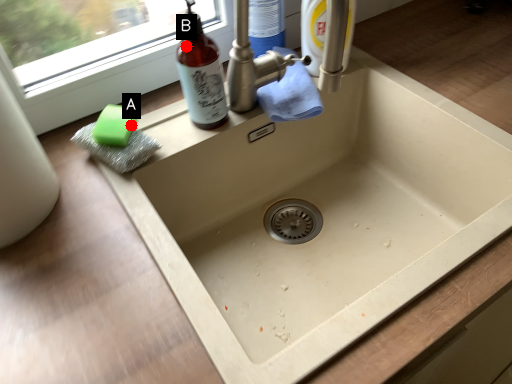
Question: Two points are circled on the image, labeled by A and B beside each circle. Which point appears farthest from the camera in this image?

Choices:
 (A) A is further
 (B) B is further

Answer: (B)